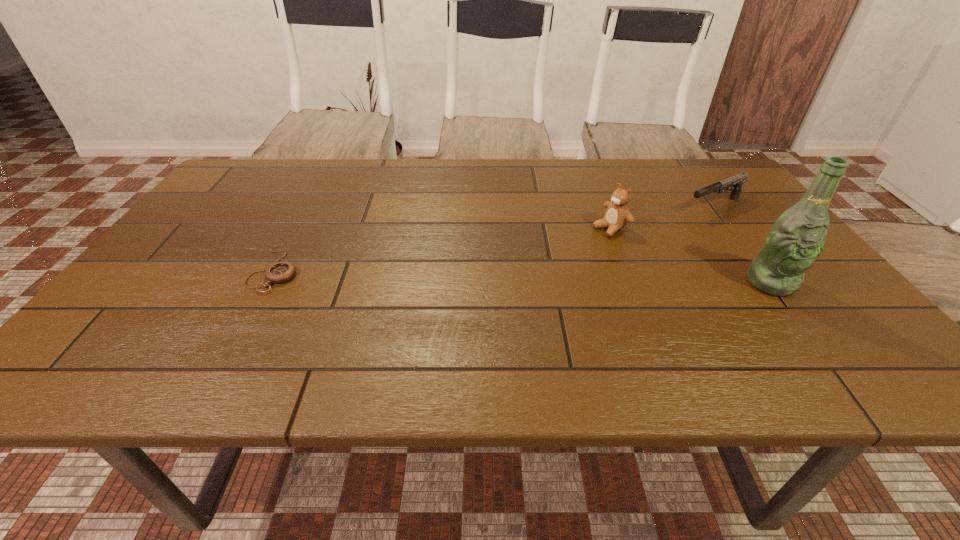
Locate an element on the screen. Image resolution: width=960 pixels, height=540 pixels. empty space between the pocket watch and the beer bottle is located at coordinates (523, 277).

Image resolution: width=960 pixels, height=540 pixels. Identify the location of free space between the beer bottle and the third shortest object. (690, 255).

You are a GUI agent. You are given a task and a screenshot of the screen. Output one action in this format:
    pyautogui.click(x=<x>, y=<y>)
    Task: Click on the unoccupied area between the teddy bear and the gun
    This screenshot has width=960, height=540.
    Given the screenshot: What is the action you would take?
    pyautogui.click(x=662, y=217)

The image size is (960, 540). What are the coordinates of `free space between the second object from left to right and the second shortest object` in the screenshot? It's located at (662, 217).

Select which object appears as the third closest to the tallest object. Please provide its 2D coordinates. Your answer should be formatted as a tuple, i.e. [(x, y)], where the tuple contains the x and y coordinates of a point satisfying the conditions above.

[(279, 272)]

Find the location of a particular element. The width and height of the screenshot is (960, 540). the third closest object to the third object from right to left is located at coordinates (279, 272).

The image size is (960, 540). In order to click on blank space that satisfies the following two spatial constraints: 1. on the back side of the gun; 2. on the right side of the pocket watch in this screenshot , I will do [310, 207].

At what (x,y) coordinates should I click in order to perform the action: click on free space that satisfies the following two spatial constraints: 1. on the back side of the second object from left to right; 2. on the right side of the gun. Please return your answer as a coordinate pair (x, y). The height and width of the screenshot is (540, 960). Looking at the image, I should click on (602, 207).